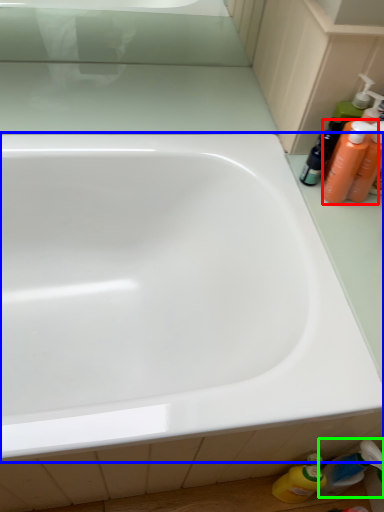
Question: Which object is the farthest from cleaning product (highlighted by a red box)? Choose among these: bathtub (highlighted by a blue box) or toiletry (highlighted by a green box).

Choices:
 (A) bathtub
 (B) toiletry

Answer: (B)